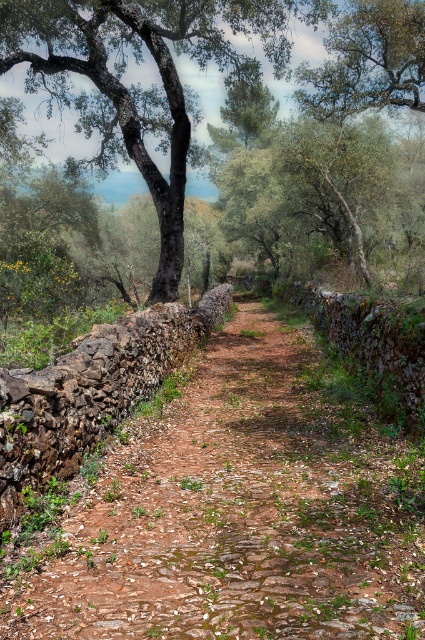
Based on the photo, you are a hiker carrying a backpack and need to cross the brown stone path at center to reach a cabin located behind the dark brown bark tree at upper left. Can you walk straight towards the tree without stepping off the path?

The brown stone path at center and dark brown bark tree at upper left are 10.01 meters apart from each other. Since the path is at the center and the tree is at the upper left, you can walk straight towards the tree while staying on the path as long as the path leads in that direction.

You are a hiker standing at the start of the brown stone path at center. You want to reach a destination behind the dark brown bark tree at upper left. Is the path wide enough for you to walk through comfortably?

The brown stone path at center occupies less space than the dark brown bark tree at upper left, so it may be narrower than the tree. However, since the path is designed for hikers, it should still be wide enough for comfortable passage, though slightly narrower than the tree area.